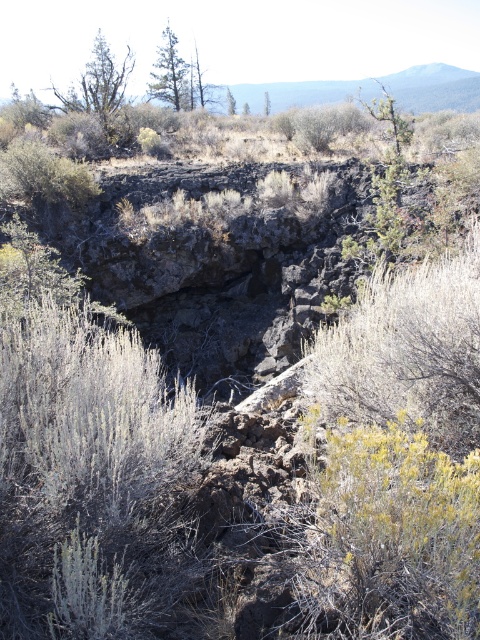
You are hiking in this landscape and want to take a photo of both the green textured tree at upper center and the green leafy tree at center. Which tree should you focus on first to ensure both are in sharp focus?

You should focus on the green textured tree at upper center first because it is closer to you than the green leafy tree at center, so adjusting focus from near to far will help both be in sharp focus.

You are a hiker lost in a rocky landscape. You see a green textured tree at upper center. Can you estimate its position relative to the center of the image using coordinates?

The green textured tree at upper center is located at coordinates approximately 0.116 on the x axis and 0.354 on the y axis.

You are standing at point A and want to reach the green textured tree at upper center located at point B. The coordinates for point A are unknown. However, you know that point B is at point (169, 74). What direction should you move in to reach the tree?

The green textured tree at upper center is located at point (169, 74), so you should move towards that coordinate to reach it.